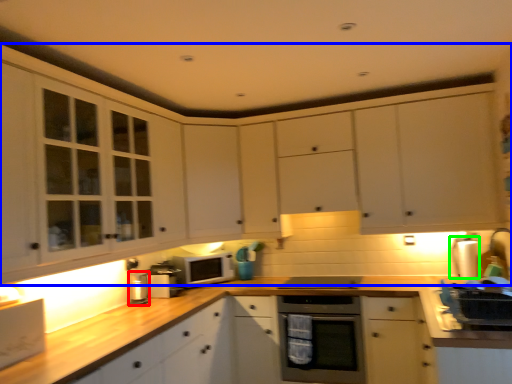
Question: Which object is the closest to the appliance (highlighted by a red box)? Choose among these: cabinetry (highlighted by a blue box) or appliance (highlighted by a green box).

Choices:
 (A) cabinetry
 (B) appliance

Answer: (A)